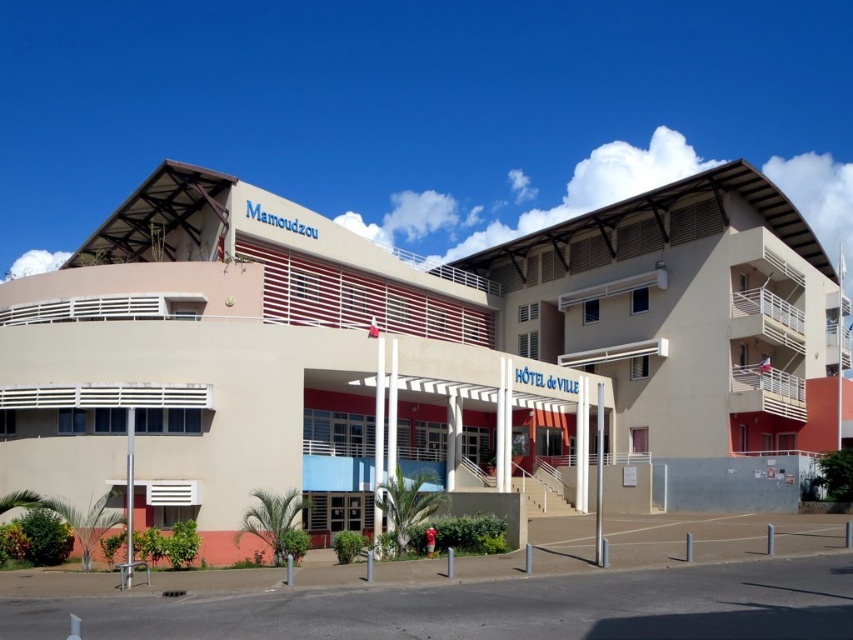
You are standing at the entrance of the H?tel de Ville in Mamoudzou and want to locate the beige concrete building at center. According to the map coordinates provided, where should you look relative to your current position?

The beige concrete building at center is located at coordinates point (263, 368), so relative to your current position at the entrance, you should look towards the direction indicated by those coordinates to find it.

You are a visitor arriving at the Htel de Ville in Mamoudzou and see the beige concrete building at center and the beige concrete hotel de ville at center. Which one is taller?

The beige concrete hotel de ville at center is taller than the beige concrete building at center.

You are a city planner reviewing architectural plans for a new town hall. The proposed design includes a beige concrete building at center and a beige concrete hotel de ville at center. Based on the provided image, which structure should be considered the actual town hall, and why?

The beige concrete hotel de ville at center is the actual town hall because the signage indicates it as the Town Hall, as mentioned in the scene description.